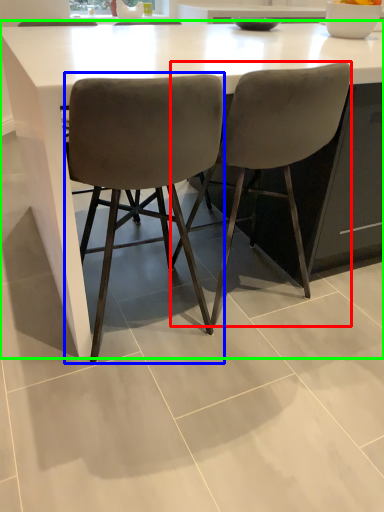
Question: Which is farther away from chair (highlighted by a red box)? chair (highlighted by a blue box) or table (highlighted by a green box)?

Choices:
 (A) chair
 (B) table

Answer: (B)